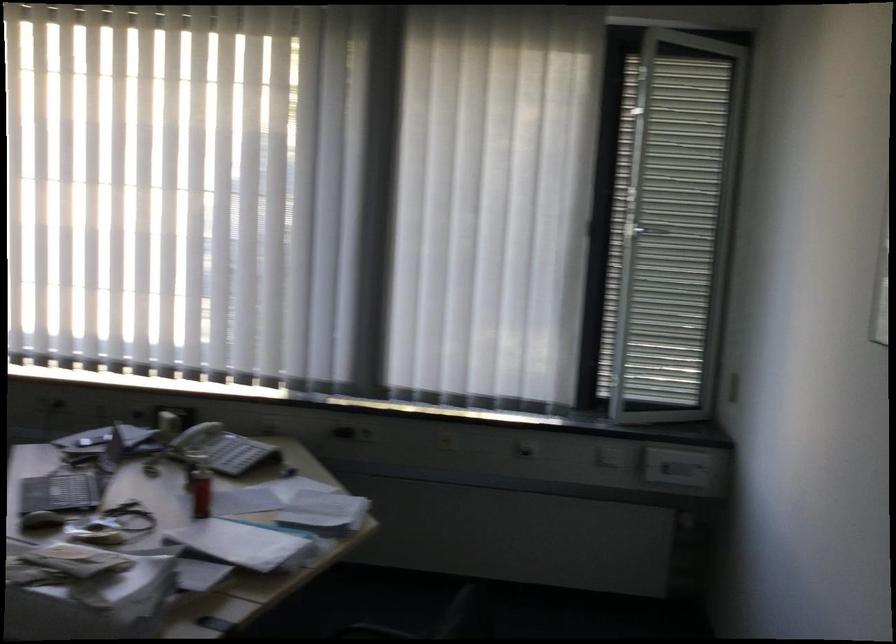
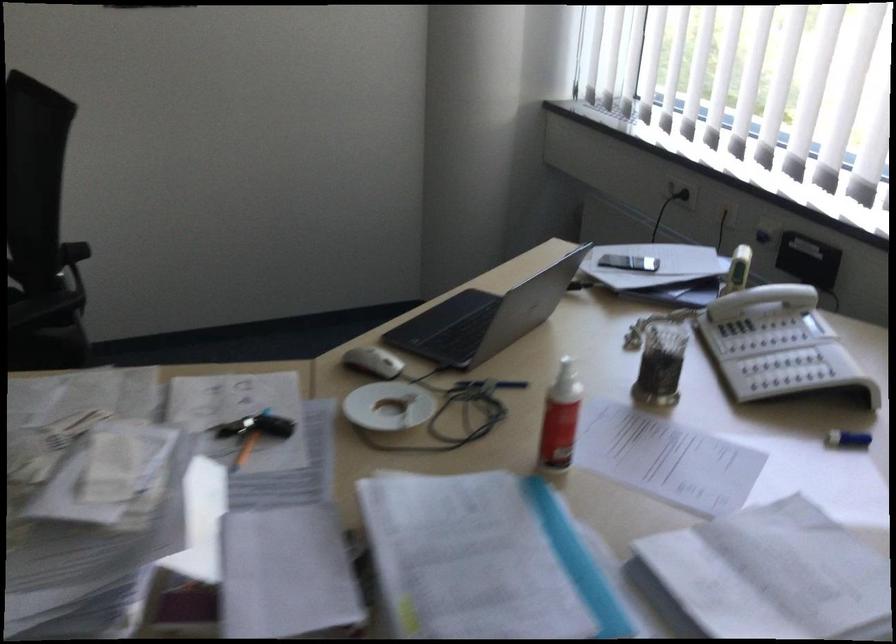
Find the pixel in the second image that matches [213,439] in the first image.

(757, 321)